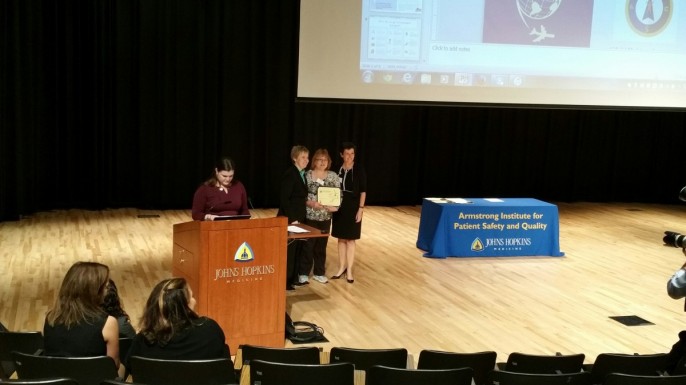
The height and width of the screenshot is (385, 686). Find the location of `award certificate`. award certificate is located at coordinates (327, 199).